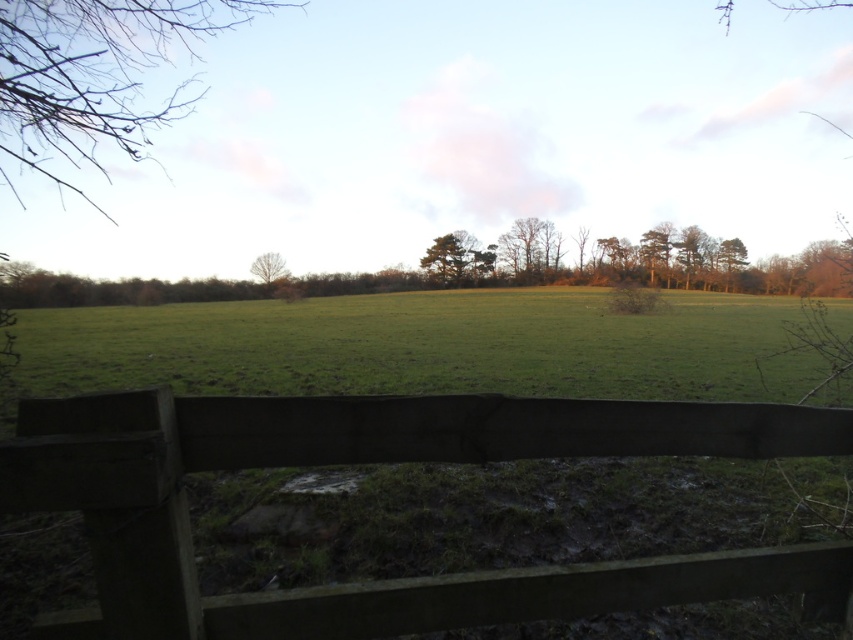
Where is `dark brown wooden fence at lower center`? This screenshot has width=853, height=640. dark brown wooden fence at lower center is located at coordinates (380, 461).

Is point (144, 444) farther from viewer compared to point (740, 252)?

No, it is in front of (740, 252).

Is point (532, 598) positioned in front of point (740, 268)?

Yes, it is.

Find the location of a particular element. This screenshot has height=640, width=853. dark brown wooden fence at lower center is located at coordinates (380, 461).

Can you confirm if green leafy tree at upper right is taller than bare branches at center?

Indeed, green leafy tree at upper right has a greater height compared to bare branches at center.

Measure the distance between green leafy tree at upper right and bare branches at center.

green leafy tree at upper right and bare branches at center are 71.82 meters apart.

Which is behind, point (726, 288) or point (277, 275)?

Point (726, 288)

The width and height of the screenshot is (853, 640). I want to click on green leafy tree at upper right, so click(x=730, y=257).

Between point (525, 275) and point (281, 259), which one is positioned in front?

Positioned in front is point (281, 259).

Which is more to the left, brown textured tree at center or bare branches at center?

From the viewer's perspective, bare branches at center appears more on the left side.

Locate an element on the screen. brown textured tree at center is located at coordinates (527, 246).